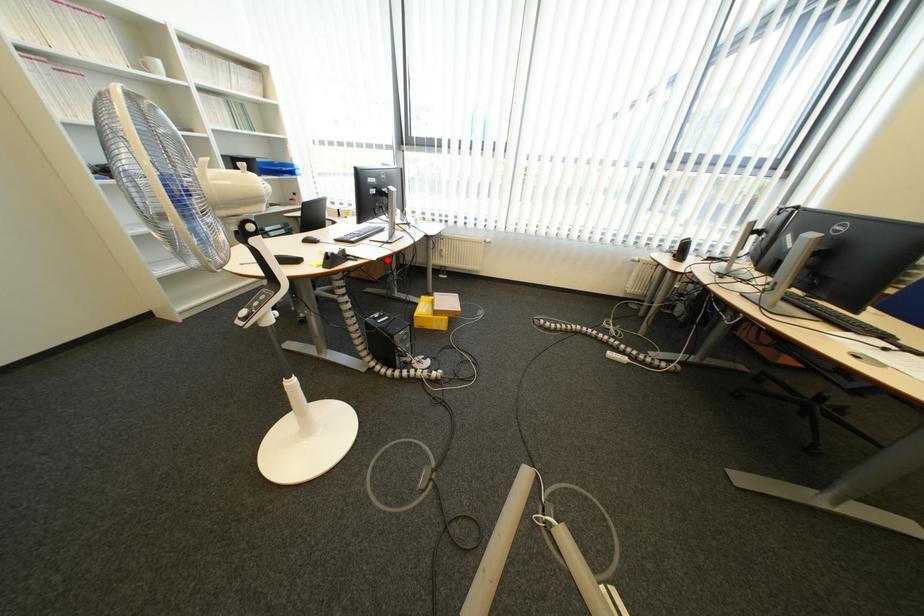
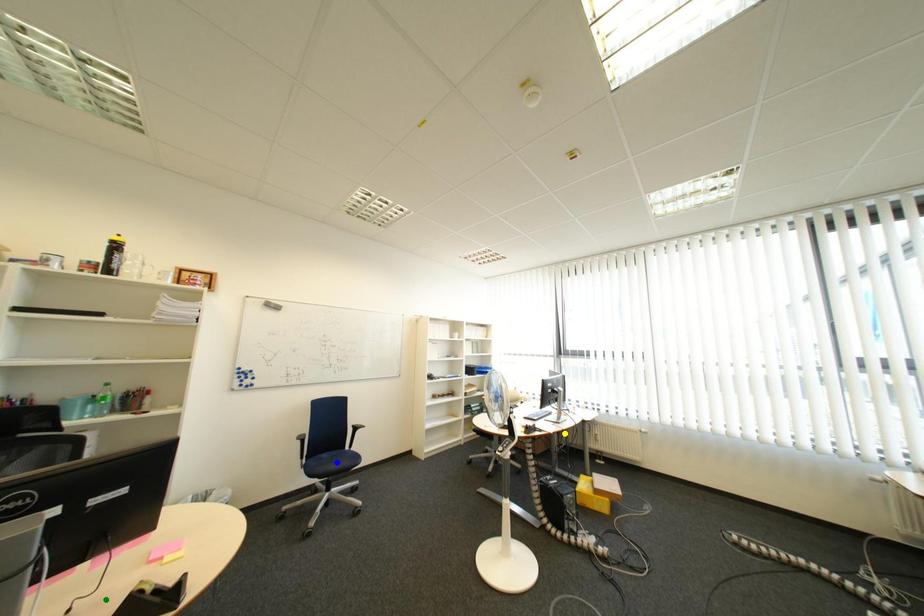
Question: I am providing you with two images of the same scene from different viewpoints. A red point is marked on the first image. You are given multiple points on the second image. In image 2, which mark is for the same physical point as the one in image 1?

Choices:
 (A) green point
 (B) blue point
 (C) yellow point

Answer: (C)